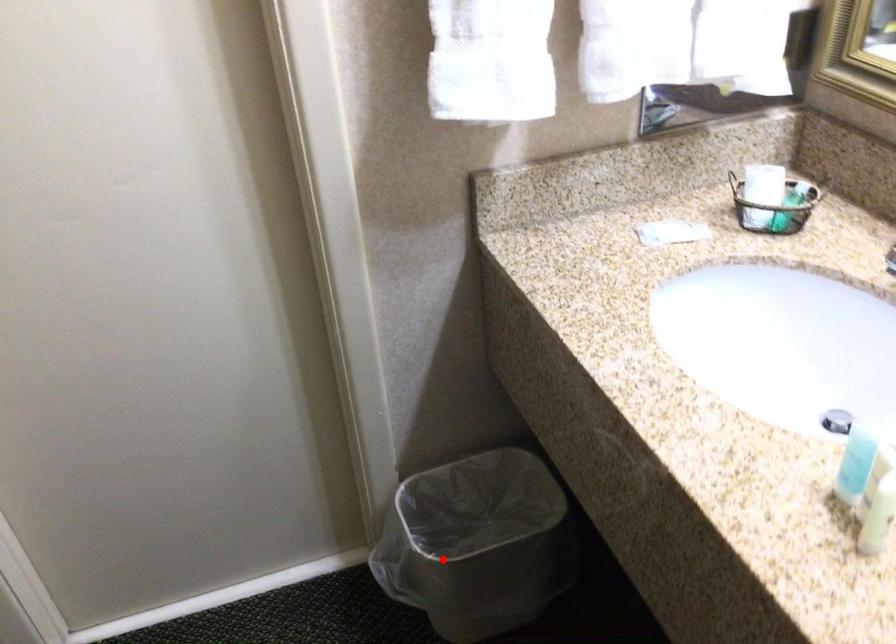
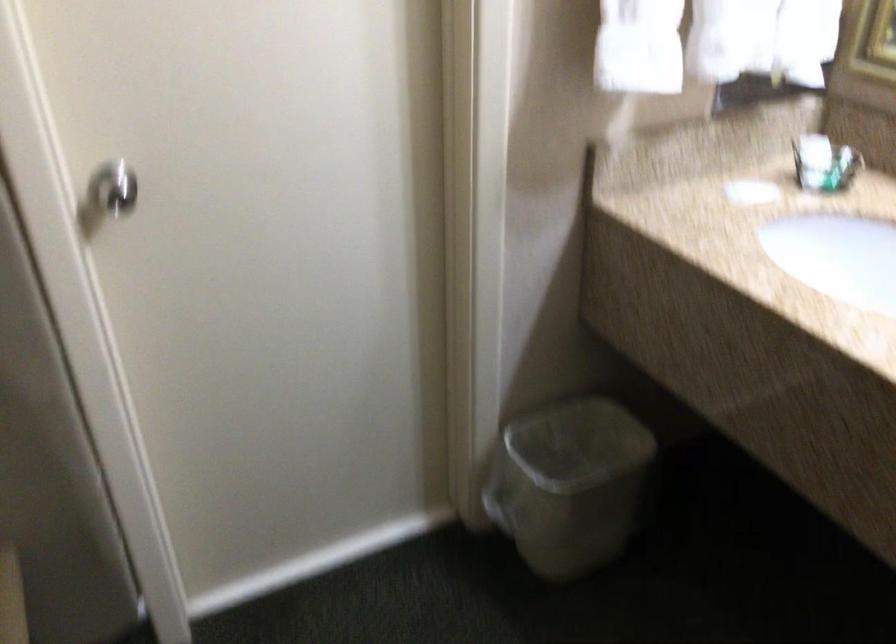
Question: I am providing you with two images of the same scene from different viewpoints. A red point is shown in image1. For the corresponding object point in image2, is it positioned nearer or farther from the camera?

Choices:
 (A) Nearer
 (B) Farther

Answer: (B)